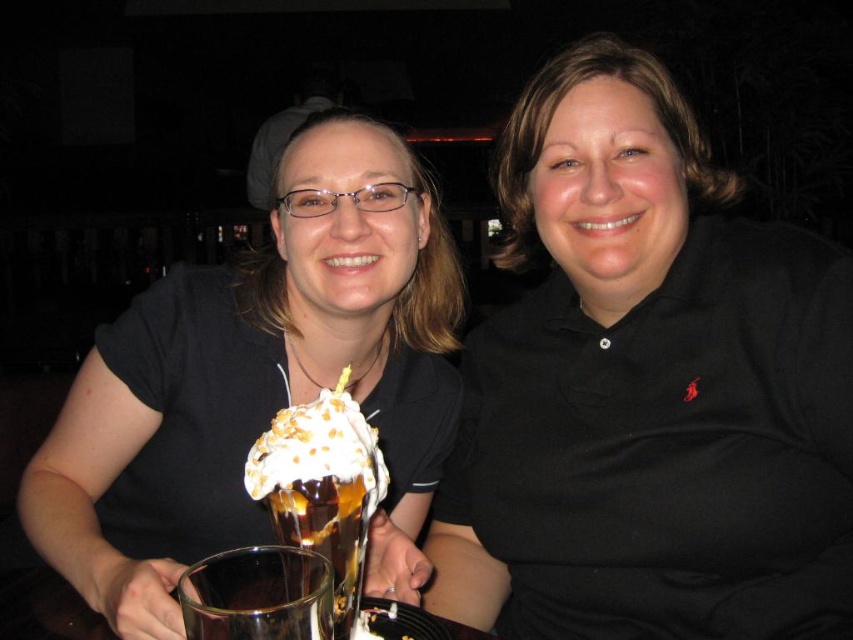
Question: Is black matte shirt at center thinner than whipped cream topped sundae at center?

Choices:
 (A) no
 (B) yes

Answer: (A)

Question: Which point appears closest to the camera in this image?

Choices:
 (A) coord(660,420)
 (B) coord(428,449)
 (C) coord(194,637)
 (D) coord(294,525)

Answer: (C)

Question: Where is transparent glass at lower center located in relation to translucent glass cup at center in the image?

Choices:
 (A) right
 (B) left

Answer: (B)

Question: In this image, where is whipped cream topped sundae at center located relative to transparent glass at lower center?

Choices:
 (A) above
 (B) below

Answer: (A)

Question: Among these points, which one is nearest to the camera?

Choices:
 (A) (294, 557)
 (B) (439, 579)
 (C) (354, 572)
 (D) (160, 486)

Answer: (A)

Question: Which point appears closest to the camera in this image?

Choices:
 (A) (663, 269)
 (B) (315, 577)
 (C) (235, 544)

Answer: (B)